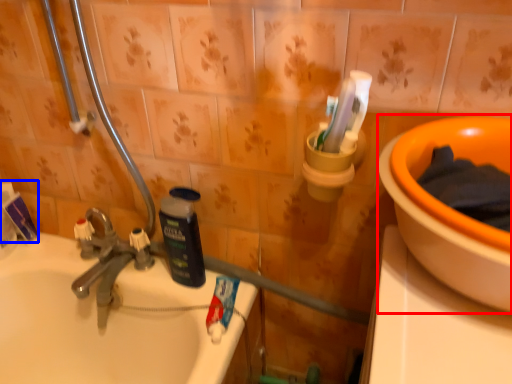
Question: Which point is closer to the camera, basin (highlighted by a red box) or toothpaste (highlighted by a blue box)?

Choices:
 (A) basin
 (B) toothpaste

Answer: (A)